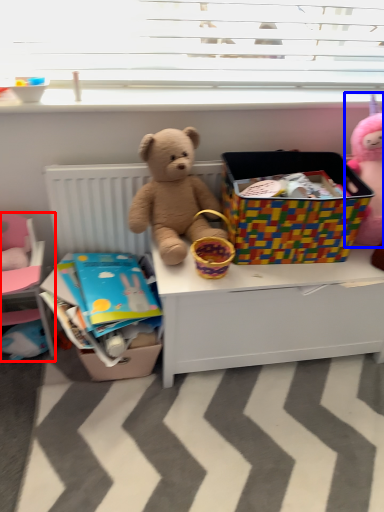
Question: Which of the following is the closest to the observer, bed (highlighted by a red box) or toy (highlighted by a blue box)?

Choices:
 (A) bed
 (B) toy

Answer: (B)